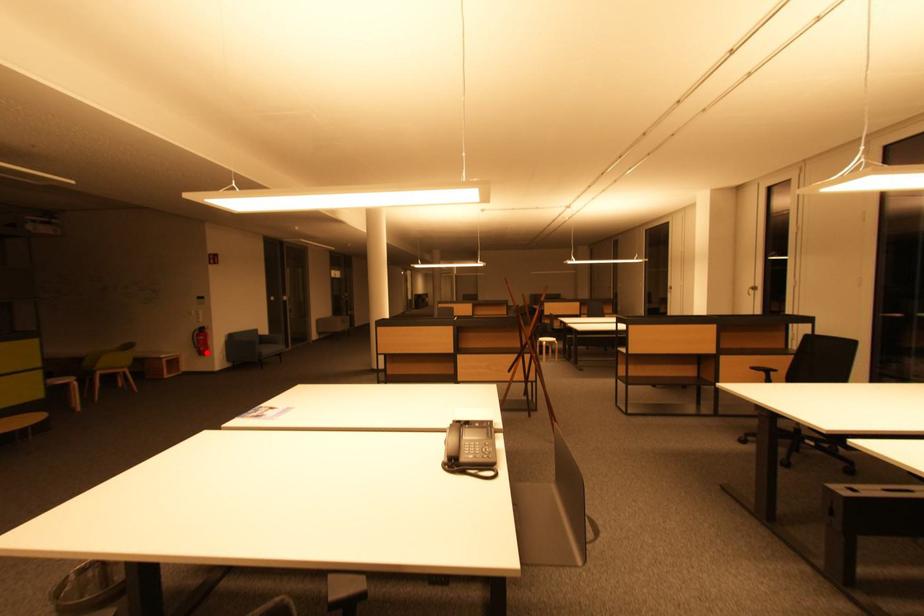
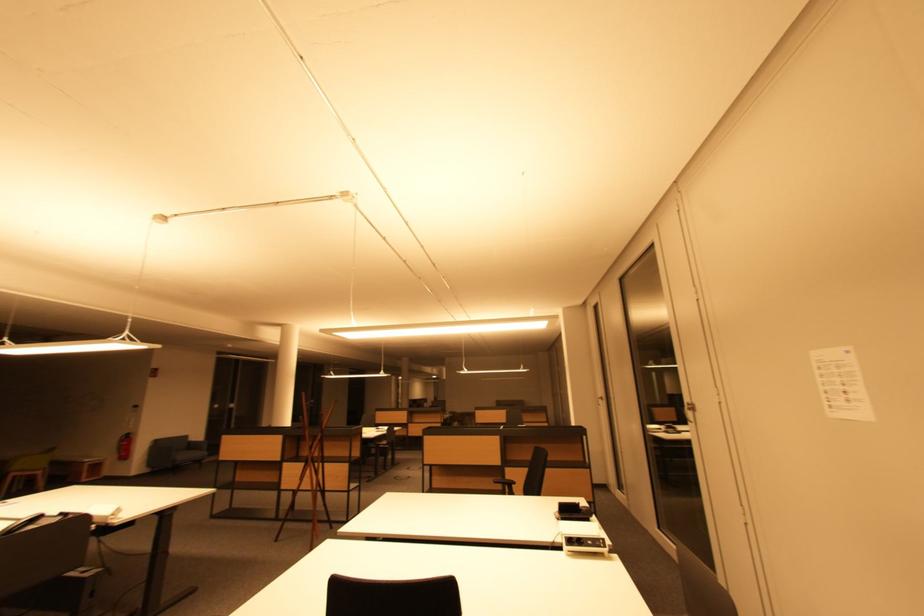
The point at the highlighted location is marked in the first image. Where is the corresponding point in the second image?

(128, 458)